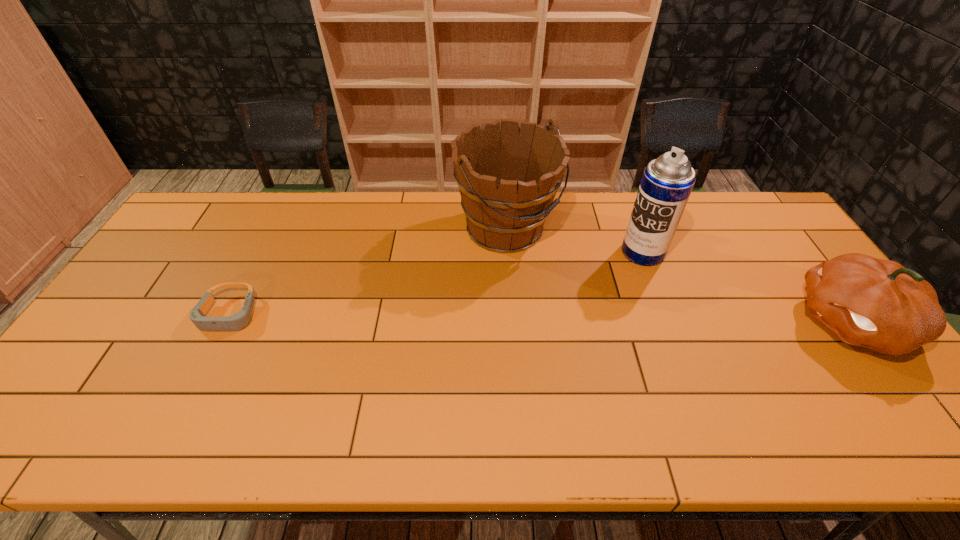
The width and height of the screenshot is (960, 540). Identify the location of vacant space located 0.110m on the label side of the aerosol can. (606, 278).

The width and height of the screenshot is (960, 540). I want to click on vacant space located 0.370m on the label side of the aerosol can, so click(543, 322).

Locate an element on the screen. This screenshot has height=540, width=960. vacant position located on the label side of the aerosol can is located at coordinates (564, 307).

Find the location of `free location located with the handle on the third object from right to left`. free location located with the handle on the third object from right to left is located at coordinates (569, 279).

Where is `free region located with the handle on the third object from right to left`? The height and width of the screenshot is (540, 960). free region located with the handle on the third object from right to left is located at coordinates (591, 298).

Identify the location of free space located 0.350m with the handle on the third object from right to left. (634, 332).

At what (x,y) coordinates should I click in order to perform the action: click on object that is at the far edge. Please return your answer as a coordinate pair (x, y). Looking at the image, I should click on (507, 180).

Identify the location of object that is at the right edge. The height and width of the screenshot is (540, 960). (879, 304).

This screenshot has height=540, width=960. In order to click on vacant region at the far edge in this screenshot , I will do `click(606, 228)`.

Image resolution: width=960 pixels, height=540 pixels. In the image, there is a desktop. In order to click on vacant space at the near edge in this screenshot , I will do `click(334, 402)`.